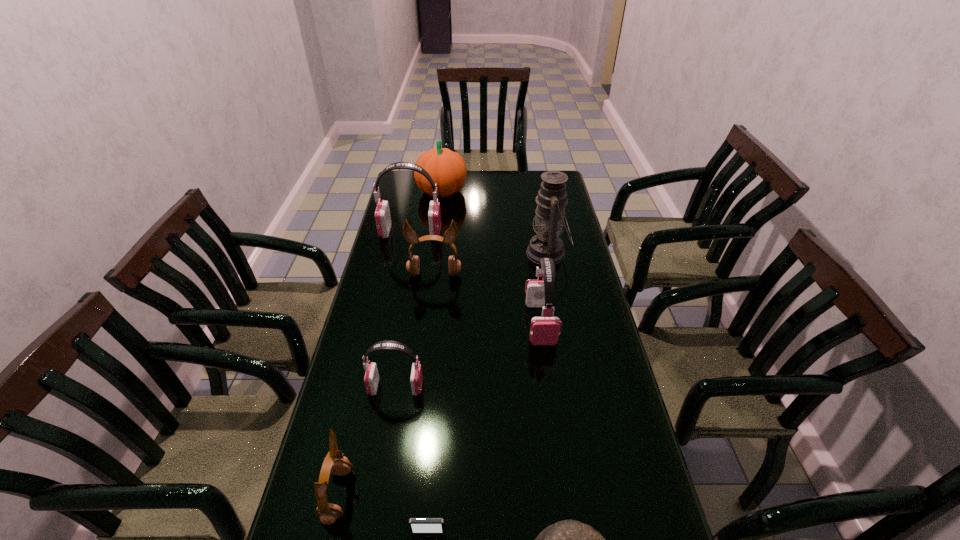
Find the location of a particular element. object that is at the far edge is located at coordinates (447, 168).

Identify the location of pumpkin that is at the left edge. (447, 168).

Locate an element on the screen. This screenshot has width=960, height=540. oil lamp that is at the right edge is located at coordinates (552, 197).

The height and width of the screenshot is (540, 960). In order to click on earphone at the right edge in this screenshot , I will do `click(545, 330)`.

Image resolution: width=960 pixels, height=540 pixels. I want to click on object present at the far left corner, so click(x=447, y=168).

Where is `blank space at the far edge of the desktop`? The height and width of the screenshot is (540, 960). blank space at the far edge of the desktop is located at coordinates (461, 194).

What are the coordinates of `vacant space at the left edge of the desktop` in the screenshot? It's located at (396, 197).

At what (x,y) coordinates should I click in order to perform the action: click on vacant region at the right edge. Please return your answer as a coordinate pair (x, y). The height and width of the screenshot is (540, 960). Looking at the image, I should click on (596, 435).

Where is `free point between the nearest pink earphone and the orange pumpkin`? The image size is (960, 540). free point between the nearest pink earphone and the orange pumpkin is located at coordinates (419, 289).

In order to click on vacant point located between the third nearest object and the bigger brown earphone in this screenshot , I will do `click(386, 384)`.